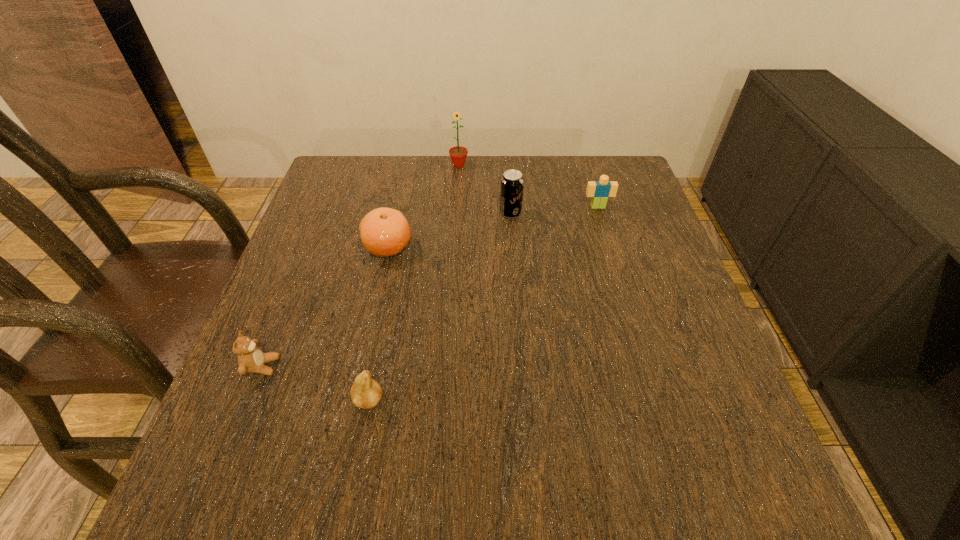
Locate an element on the screen. The height and width of the screenshot is (540, 960). free space between the leftmost object and the rightmost object is located at coordinates click(x=430, y=287).

Locate an element on the screen. This screenshot has height=540, width=960. vacant region between the fourth farthest object and the tallest object is located at coordinates (423, 206).

Image resolution: width=960 pixels, height=540 pixels. What are the coordinates of `vacant point located between the second tallest object and the leftmost object` in the screenshot? It's located at (387, 290).

Identify the location of unoccupied position between the rightmost object and the nearest object. (484, 303).

The image size is (960, 540). In order to click on free area in between the fifth object from left to right and the third object from right to left in this screenshot , I will do `click(485, 190)`.

At what (x,y) coordinates should I click in order to perform the action: click on blank region between the second tallest object and the nearest object. Please return your answer as a coordinate pair (x, y). Looking at the image, I should click on (440, 307).

Locate an element on the screen. The width and height of the screenshot is (960, 540). free point between the soda can and the rightmost object is located at coordinates tap(554, 210).

Locate an element on the screen. This screenshot has height=540, width=960. empty space that is in between the farthest object and the third nearest object is located at coordinates point(423,206).

Identify the location of object that stands as the fourth closest to the clementine. (366, 393).

Where is `the second closest object to the third object from right to left`? the second closest object to the third object from right to left is located at coordinates (384, 231).